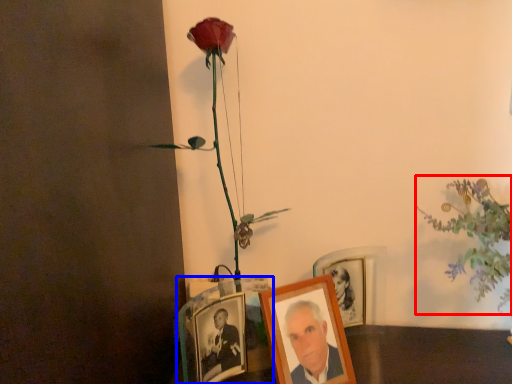
Question: Which of the following is the farthest to the observer, floral arrangement (highlighted by a red box) or picture frame (highlighted by a blue box)?

Choices:
 (A) floral arrangement
 (B) picture frame

Answer: (B)